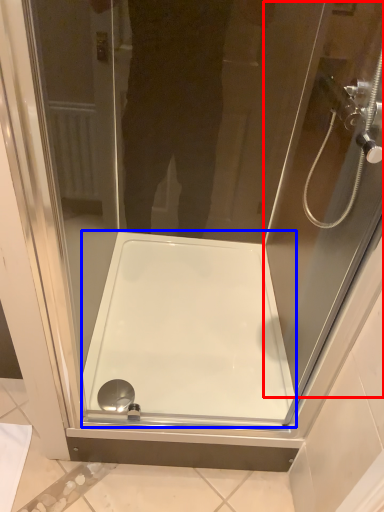
Question: Among these objects, which one is nearest to the camera, screen door (highlighted by a red box) or bath (highlighted by a blue box)?

Choices:
 (A) screen door
 (B) bath

Answer: (A)